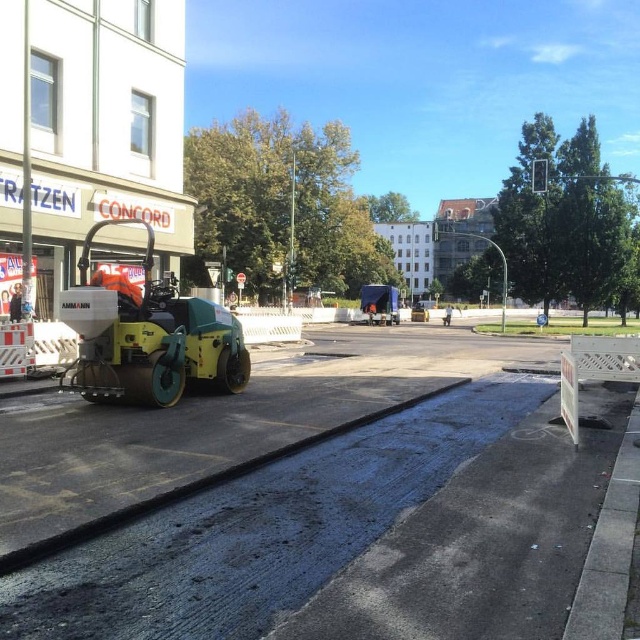
You are a pedestrian trying to cross the street where road construction is happening. You see a green rubber road roller at left and an orange reflective vest at center. Which object is closer to the left side of the street?

The green rubber road roller at left is closer to the left side of the street because it is positioned to the left of the orange reflective vest at center.

You are a delivery driver who needs to pass through the construction zone with a truck that is 3.5 meters wide. The barriers are placed between the yellow and green steamroller and the point at (156, 292). Can your truck fit through the gap between the barriers?

The barriers are 10.70 meters apart, so yes, the truck can fit through the gap since it is wider than the truck.

You are a construction worker standing at the yellow and green steamroller on the left side. You need to place a safety cone at the point closer to you between point (371, 296) and point (445, 323). Which point should you choose?

You should choose point (371, 296) because it is closer to the viewer than point (445, 323).